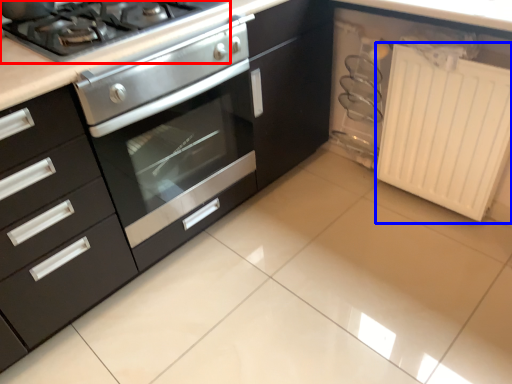
Question: Which object appears farthest to the camera in this image, gas stove (highlighted by a red box) or radiator (highlighted by a blue box)?

Choices:
 (A) gas stove
 (B) radiator

Answer: (B)